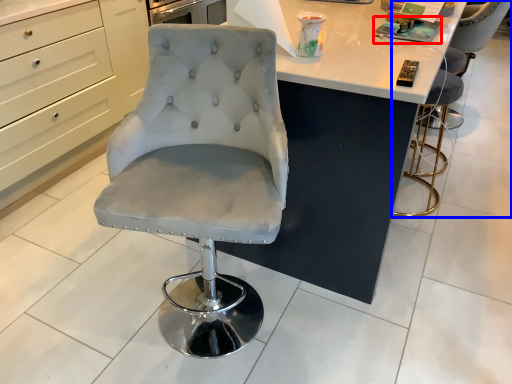
Question: Which point is closer to the camera, magazine (highlighted by a red box) or chair (highlighted by a blue box)?

Choices:
 (A) magazine
 (B) chair

Answer: (A)